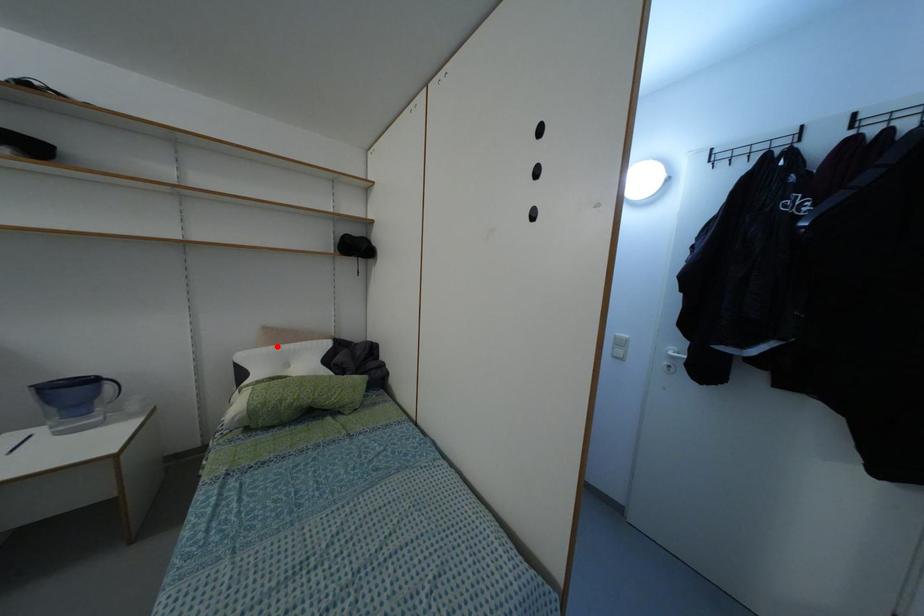
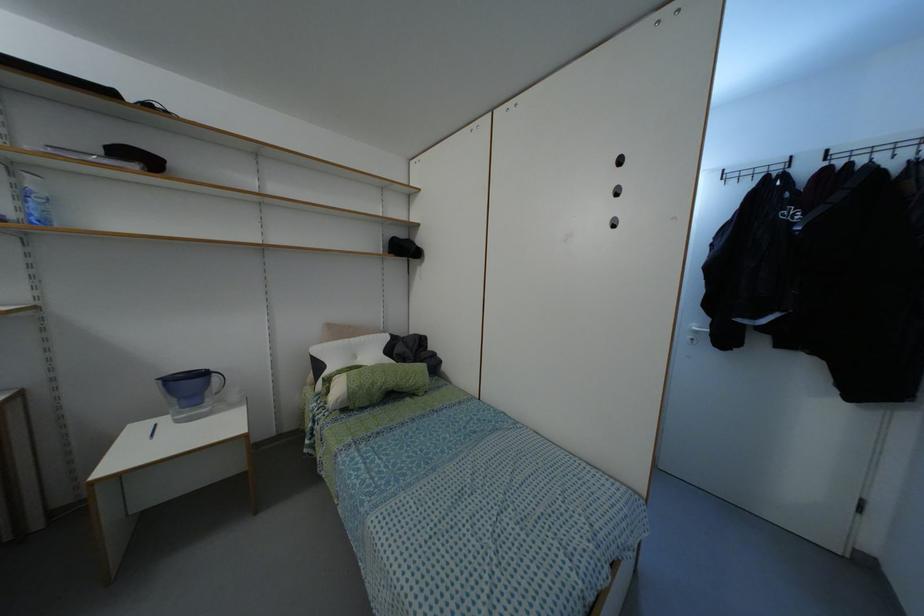
The point at the highlighted location is marked in the first image. Where is the corresponding point in the second image?

(345, 339)